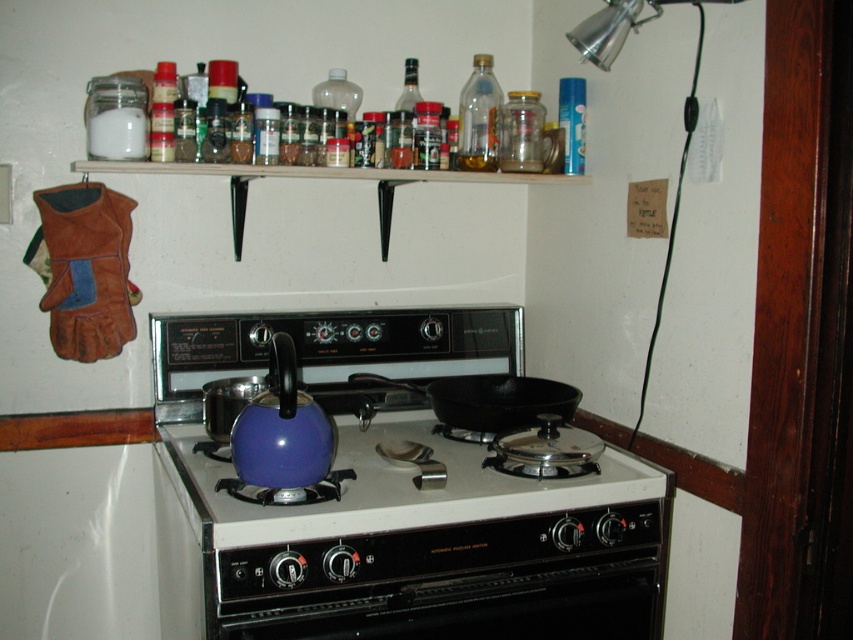
Question: Is glossy enamel teapot at center closer to camera compared to black cast iron frying pan at center?

Choices:
 (A) yes
 (B) no

Answer: (A)

Question: Which object is the farthest from the glossy enamel teapot at center?

Choices:
 (A) black matte oven at center
 (B) matte blue kettle at center
 (C) black cast iron frying pan at center

Answer: (C)

Question: Does glossy enamel teapot at center have a smaller size compared to transparent plastic bottle at upper center?

Choices:
 (A) no
 (B) yes

Answer: (A)

Question: Which point is farther from the camera taking this photo?

Choices:
 (A) (291, 600)
 (B) (281, 410)
 (C) (486, 56)
 (D) (154, 404)

Answer: (C)

Question: Does matte blue kettle at center have a greater width compared to transparent plastic bottle at upper center?

Choices:
 (A) no
 (B) yes

Answer: (B)

Question: Which point appears farthest from the camera in this image?

Choices:
 (A) (561, 612)
 (B) (482, 81)

Answer: (B)